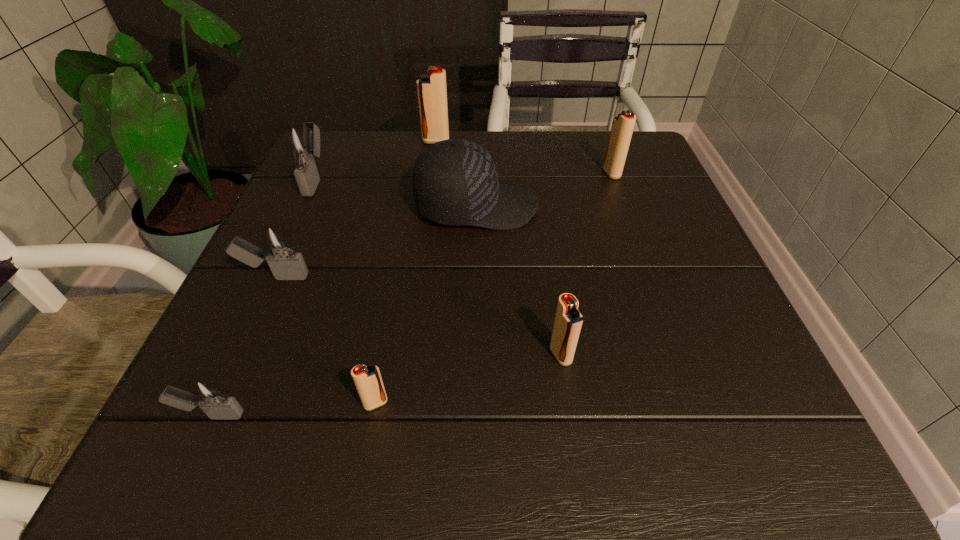
In order to click on vacant space in between the biggest gray igniter and the baseball cap in this screenshot , I will do `click(396, 193)`.

Where is `vacant area that lies between the baseball cap and the biggest gray igniter`? The height and width of the screenshot is (540, 960). vacant area that lies between the baseball cap and the biggest gray igniter is located at coordinates (396, 193).

Identify which object is the fifth closest to the rightmost red igniter. Please provide its 2D coordinates. Your answer should be formatted as a tuple, i.e. [(x, y)], where the tuple contains the x and y coordinates of a point satisfying the conditions above.

[(279, 250)]

Identify the location of the third closest object to the biggest red igniter. (622, 128).

Locate an element on the screen. This screenshot has height=540, width=960. igniter that can be found as the fifth closest to the smallest gray igniter is located at coordinates (432, 93).

Image resolution: width=960 pixels, height=540 pixels. Find the location of `the fifth closest igniter relative to the smallest red igniter`. the fifth closest igniter relative to the smallest red igniter is located at coordinates (622, 128).

Choose which red igniter is the nearest neighbor to the third smallest red igniter. Please provide its 2D coordinates. Your answer should be formatted as a tuple, i.e. [(x, y)], where the tuple contains the x and y coordinates of a point satisfying the conditions above.

[(432, 93)]

Identify the location of red igniter that stands as the closest to the baseball cap. The width and height of the screenshot is (960, 540). (622, 128).

Locate which gray igniter ranks in proximity to the nearest red igniter. Please provide its 2D coordinates. Your answer should be formatted as a tuple, i.e. [(x, y)], where the tuple contains the x and y coordinates of a point satisfying the conditions above.

[(206, 393)]

This screenshot has width=960, height=540. Identify the location of the second closest gray igniter to the baseball cap. (301, 142).